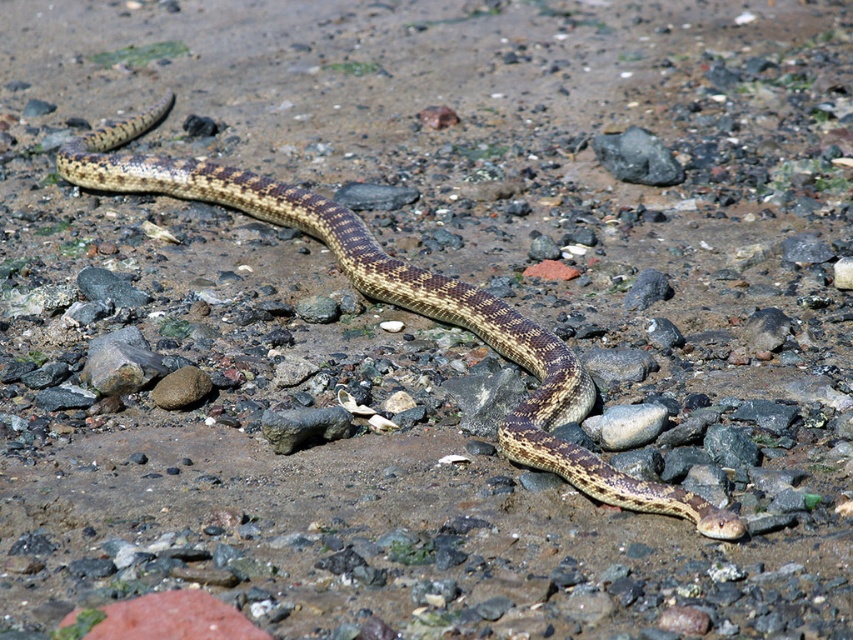
Question: Which point is closer to the camera?

Choices:
 (A) brown rough rock at center
 (B) gray smooth rock at center
 (C) gray rock at center

Answer: (B)

Question: Is smooth gray rock at center below gray rock at center?

Choices:
 (A) yes
 (B) no

Answer: (B)

Question: Which of the following is the farthest from the observer?

Choices:
 (A) gray smooth rock at center
 (B) brown rough rock at center
 (C) gray rock at center
 (D) speckled brown snake at center

Answer: (C)

Question: Does speckled brown snake at center appear over gray smooth rock at center?

Choices:
 (A) yes
 (B) no

Answer: (A)

Question: Among these points, which one is nearest to the camera?

Choices:
 (A) (x=527, y=320)
 (B) (x=325, y=419)

Answer: (B)

Question: Does rough textured rock at center appear on the left side of gray rock at center?

Choices:
 (A) no
 (B) yes

Answer: (B)